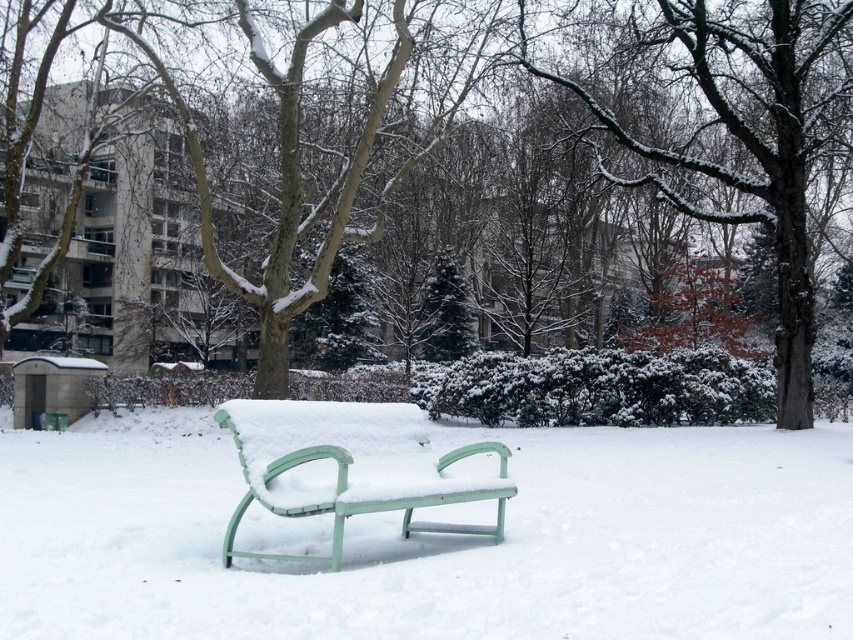
Question: Is the position of white matte bench at center more distant than that of green plastic bench at center?

Choices:
 (A) yes
 (B) no

Answer: (B)

Question: Which of these objects is positioned farthest from the green plastic bench at center?

Choices:
 (A) snow-covered tree at center
 (B) white matte bench at center

Answer: (A)

Question: Does snow-covered tree at center have a smaller size compared to white matte bench at center?

Choices:
 (A) no
 (B) yes

Answer: (A)

Question: Which point is farther to the camera?

Choices:
 (A) (405, 497)
 (B) (465, 84)
 (C) (219, 564)

Answer: (B)

Question: Which of these objects is positioned farthest from the green plastic bench at center?

Choices:
 (A) snow-covered tree at center
 (B) white matte bench at center

Answer: (A)

Question: Does snow-covered tree at center appear over green plastic bench at center?

Choices:
 (A) yes
 (B) no

Answer: (A)